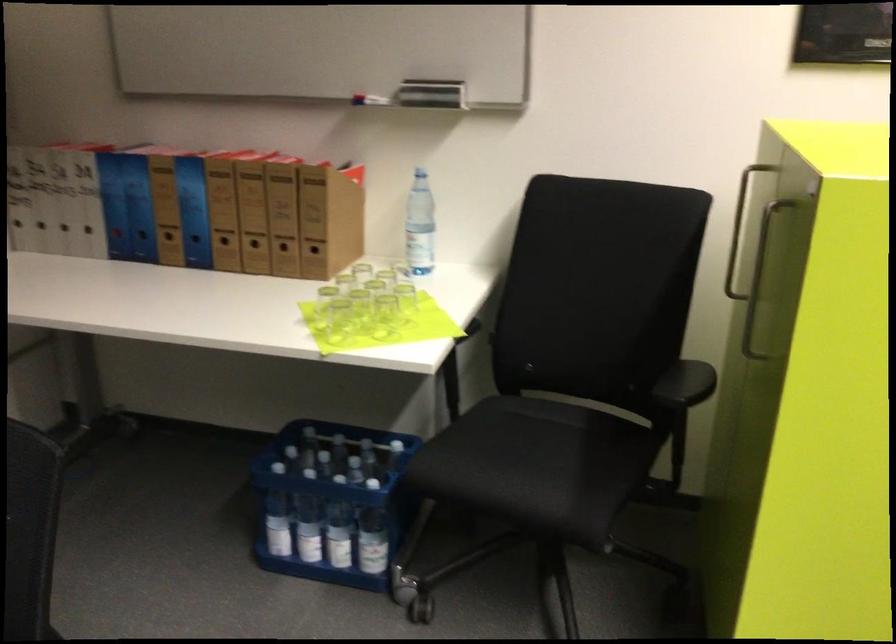
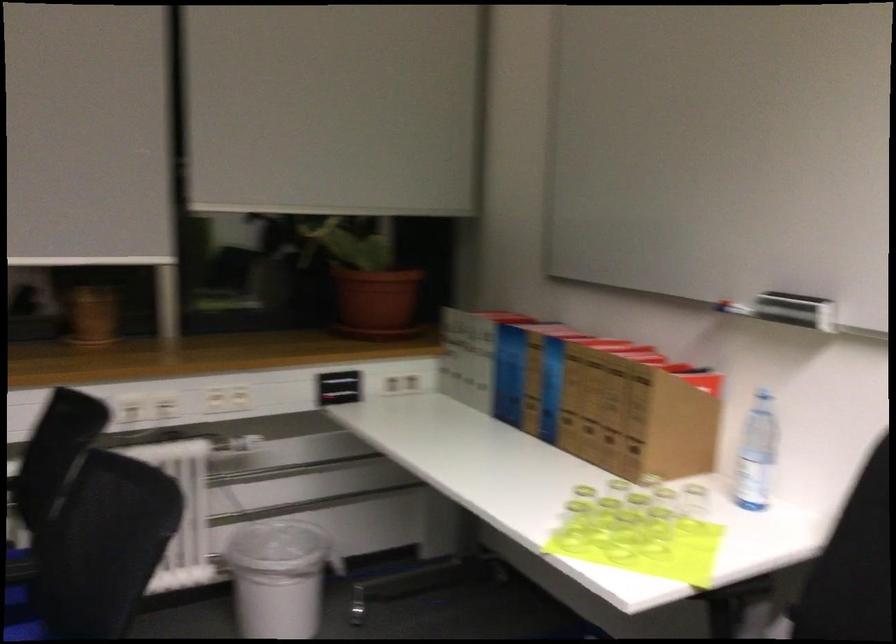
The point at [136,212] is marked in the first image. Where is the corresponding point in the second image?

(509, 374)